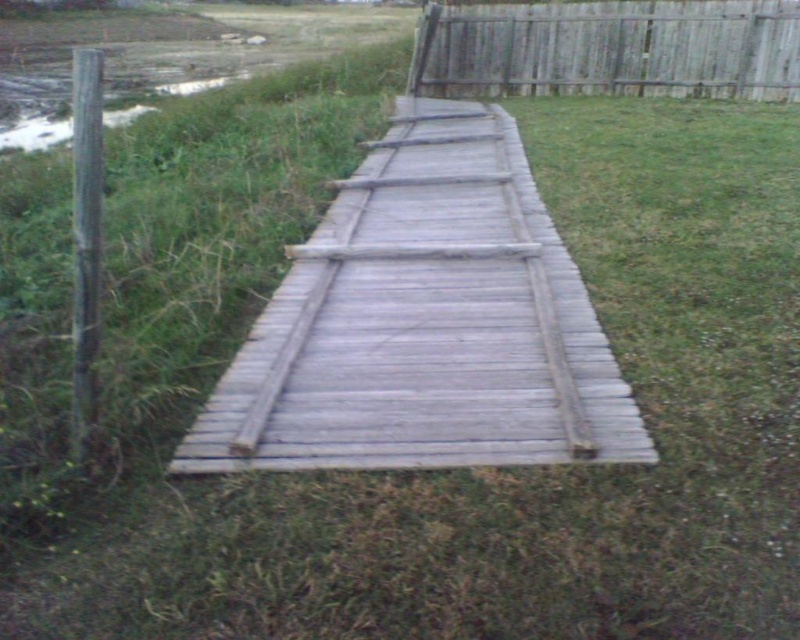
You are a gardener who needs to transport a 3.5 feet wide gardening cart across the weathered wood bridge at center and the weathered wood fence at upper right. Which structure can safely accommodate the cart based on their widths?

The weathered wood fence at upper right has a greater width than the weathered wood bridge at center. Since the cart is 3.5 feet wide, it can safely pass through the weathered wood fence at upper right but may not fit on the narrower weathered wood bridge at center.

You are a gardener who wants to mow the grass near the weathered wood bridge at center and the weathered wood fence at upper right. Which object should you approach first if you want to start from the leftmost point in the scene?

The weathered wood bridge at center should be approached first because it is positioned on the left side of the weathered wood fence at upper right, making it closer to the leftmost area of the scene.

You are a gardener who wants to walk from the pathway to the fence to trim some overgrown grass. Which direction should you move from the weathered wood bridge at center to reach the weathered wood fence at upper right?

The weathered wood bridge at center is positioned under the weathered wood fence at upper right, so you should move upward from the weathered wood bridge at center to reach the weathered wood fence at upper right.